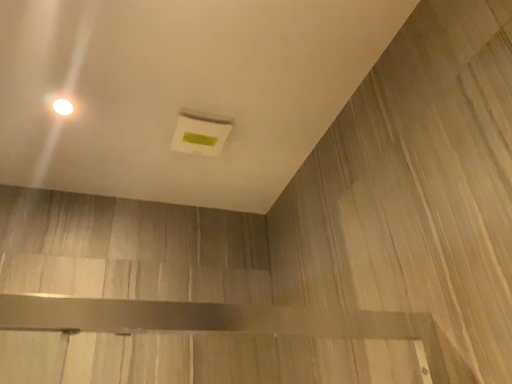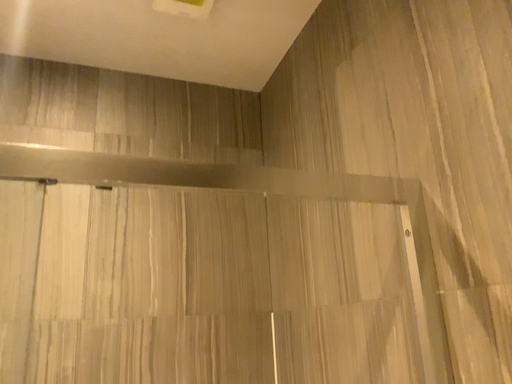
Question: Which way did the camera rotate in the video?

Choices:
 (A) rotated downward
 (B) rotated upward

Answer: (A)